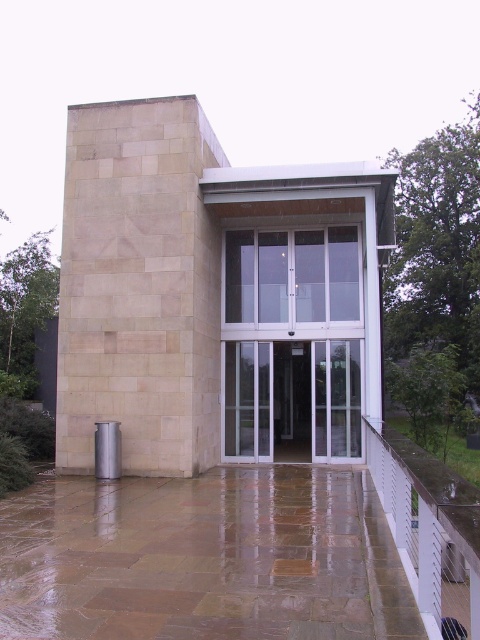
In the scene shown: Can you confirm if beige stone pillar at left is smaller than satin silver cylinder at lower left?

Indeed, beige stone pillar at left has a smaller size compared to satin silver cylinder at lower left.

Does point (165, 227) lie behind point (117, 472)?

Yes, it is behind point (117, 472).

Does point (188, 118) come in front of point (104, 436)?

No, (188, 118) is behind (104, 436).

Find the location of `beige stone pillar at left`. beige stone pillar at left is located at coordinates (139, 288).

Which is below, transparent glass door at center or satin silver cylinder at lower left?

satin silver cylinder at lower left is lower down.

Which is more to the right, transparent glass door at center or satin silver cylinder at lower left?

transparent glass door at center

I want to click on transparent glass door at center, so click(x=292, y=400).

This screenshot has height=640, width=480. In order to click on transparent glass door at center in this screenshot , I will do [x=292, y=400].

Can you confirm if beige stone pillar at left is shorter than transparent glass door at center?

Yes, beige stone pillar at left is shorter than transparent glass door at center.

Who is positioned more to the left, beige stone pillar at left or transparent glass door at center?

From the viewer's perspective, beige stone pillar at left appears more on the left side.

The width and height of the screenshot is (480, 640). Identify the location of beige stone pillar at left. (139, 288).

Where is `beige stone pillar at left`? beige stone pillar at left is located at coordinates (139, 288).